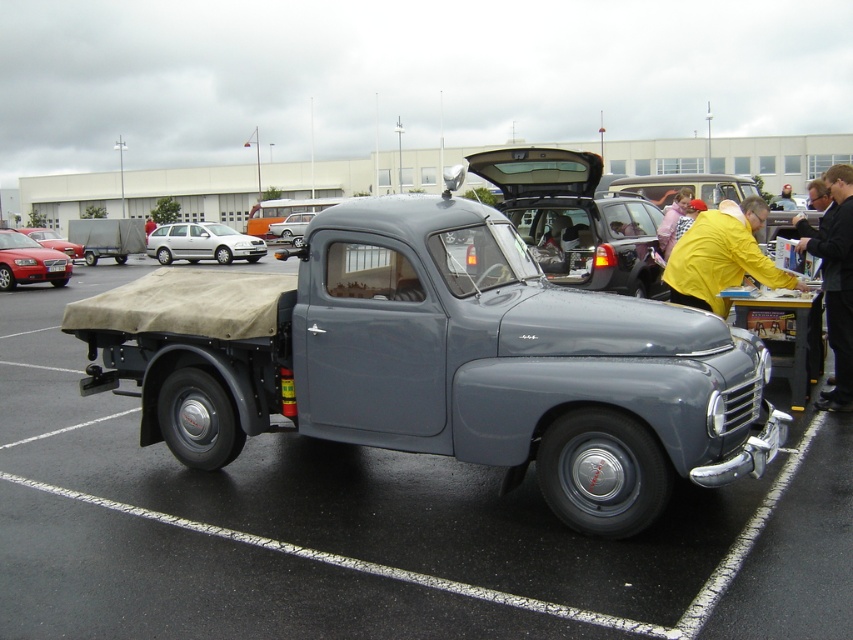
Does yellow fabric shirt at right come in front of silver metallic sedan at center?

That is True.

Does yellow fabric shirt at right have a larger size compared to silver metallic sedan at center?

Incorrect, yellow fabric shirt at right is not larger than silver metallic sedan at center.

Between point (677, 292) and point (299, 224), which one is positioned in front?

Point (677, 292) is in front.

Identify the location of yellow fabric shirt at right. (722, 257).

Does yellow fabric at right have a greater width compared to matte red car at left?

No, yellow fabric at right is not wider than matte red car at left.

Between yellow fabric at right and matte red car at left, which one is positioned lower?

yellow fabric at right

Which is in front, point (822, 275) or point (54, 280)?

Point (822, 275)

Locate an element on the screen. The height and width of the screenshot is (640, 853). yellow fabric at right is located at coordinates (836, 284).

Identify the location of silver metallic hatchback at left. This screenshot has width=853, height=640. (202, 243).

Which of these two, silver metallic hatchback at left or silver metallic sedan at center, stands shorter?

silver metallic sedan at center is shorter.

Find the location of `silver metallic hatchback at left`. silver metallic hatchback at left is located at coordinates (202, 243).